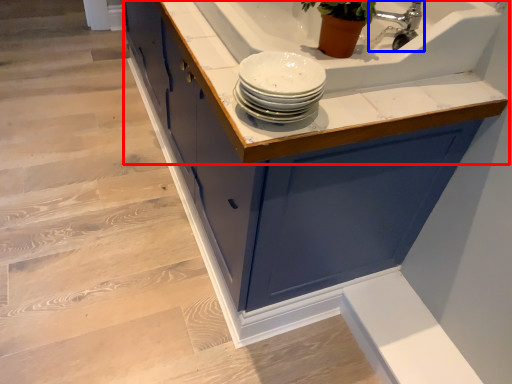
Question: Which point is closer to the camera, countertop (highlighted by a red box) or tap (highlighted by a blue box)?

Choices:
 (A) countertop
 (B) tap

Answer: (A)